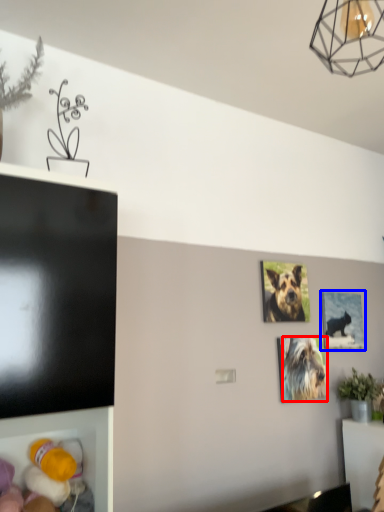
Question: Which object is closer to the camera taking this photo, dog (highlighted by a red box) or picture frame (highlighted by a blue box)?

Choices:
 (A) dog
 (B) picture frame

Answer: (A)